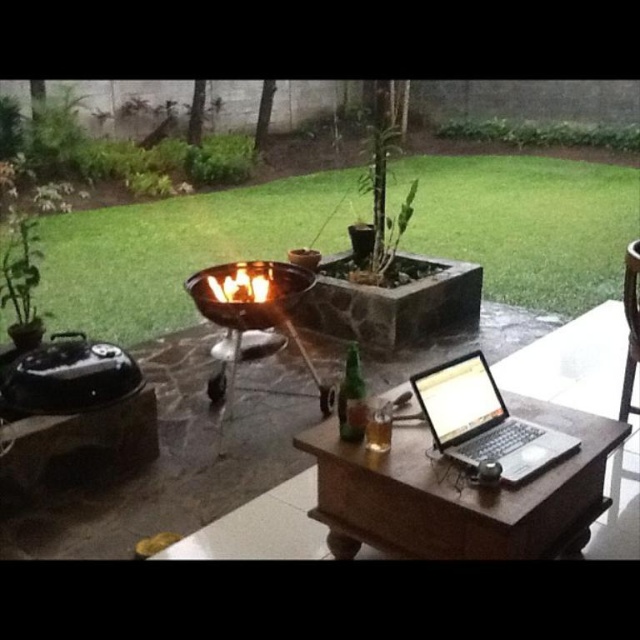
Question: Based on their relative distances, which object is nearer to the brown wooden chair at right?

Choices:
 (A) wooden table at center
 (B) flamematerial/texture at center

Answer: (A)

Question: Which of the following is the closest to the observer?

Choices:
 (A) flamematerial/texture at center
 (B) brown wooden chair at right
 (C) wooden table at center

Answer: (C)

Question: Estimate the real-world distances between objects in this image. Which object is farther from the brown wooden chair at right?

Choices:
 (A) wooden table at center
 (B) silver metallic laptop at center
 (C) flamematerial/texture at center

Answer: (C)

Question: Is silver metallic laptop at center bigger than flamematerial/texture at center?

Choices:
 (A) yes
 (B) no

Answer: (A)

Question: Is silver metallic laptop at center to the left of flamematerial/texture at center from the viewer's perspective?

Choices:
 (A) yes
 (B) no

Answer: (B)

Question: Observing the image, what is the correct spatial positioning of silver metallic laptop at center in reference to brown wooden chair at right?

Choices:
 (A) left
 (B) right

Answer: (A)